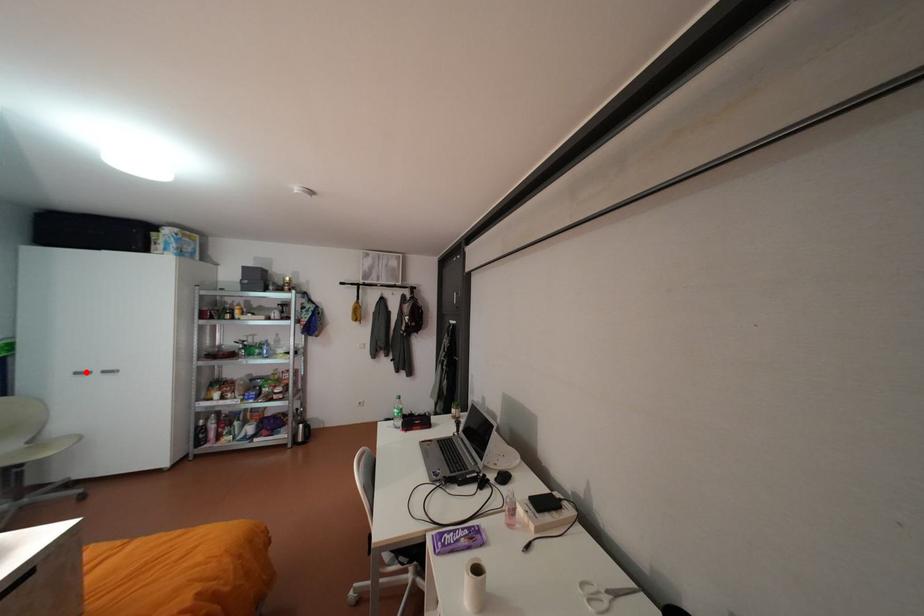
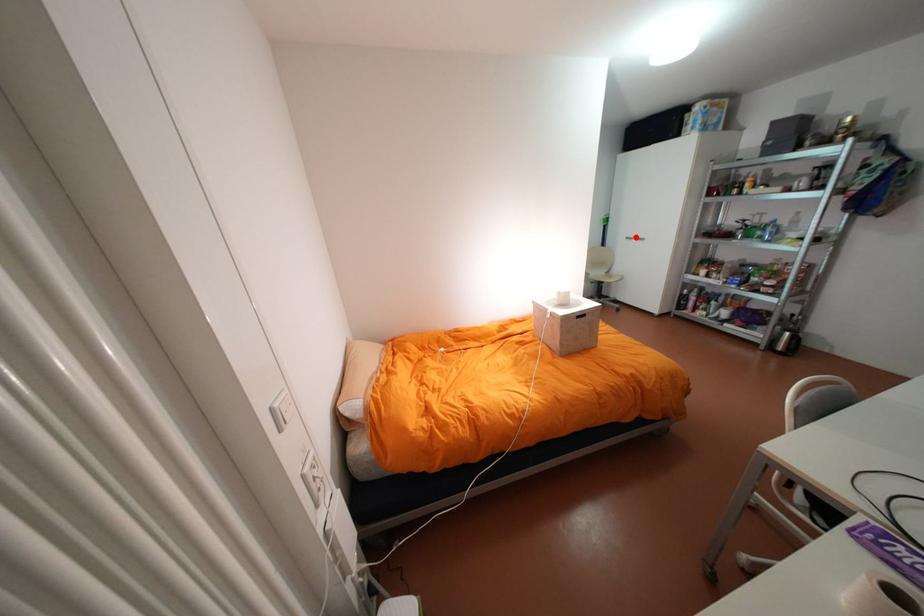
I am providing you with two images of the same scene from different viewpoints. A red point is marked on the first image and another point is marked on the second image. Is the marked point in image1 the same physical position as the marked point in image2?

Yes